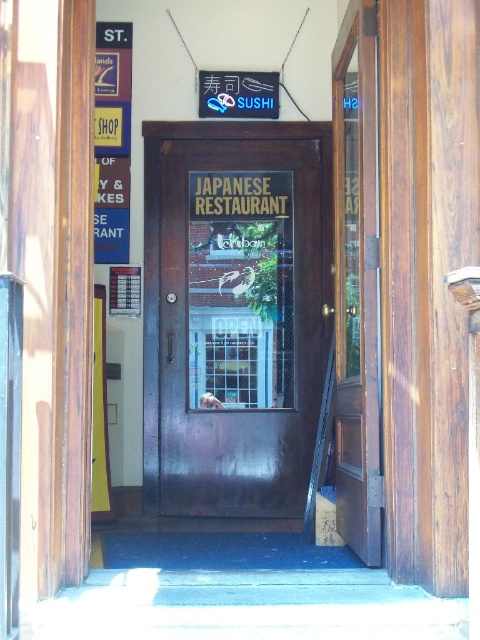
You are standing in front of the entrance of the Japanese restaurant. You need to locate the mahogany wood door at right and the metallic signboard at left. Which object is positioned more to the right side?

The mahogany wood door at right is positioned more to the right side than the metallic signboard at left.

You are standing in front of the Japanese restaurant entrance. You notice two points marked on the door and the neon sign. Which point is closer to you, point (268,248) or point (108,141)?

Point (108,141) is closer to you because the Objects Description states that point (268,248) is further away than point (108,141).